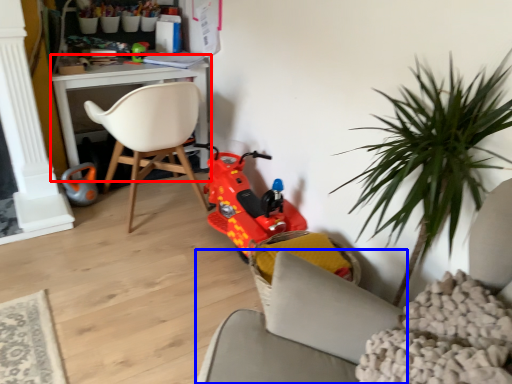
Question: Among these objects, which one is farthest to the camera, table (highlighted by a red box) or chair (highlighted by a blue box)?

Choices:
 (A) table
 (B) chair

Answer: (A)